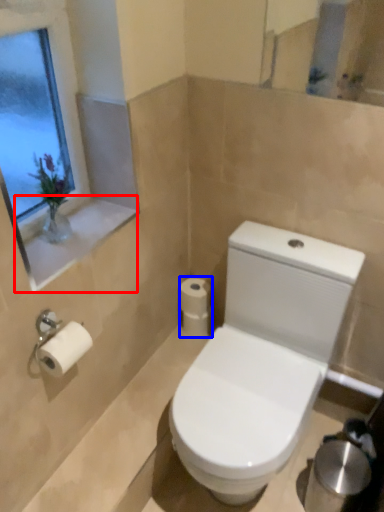
Question: Which object appears closest to the camera in this image, window sill (highlighted by a red box) or toilet paper (highlighted by a blue box)?

Choices:
 (A) window sill
 (B) toilet paper

Answer: (A)